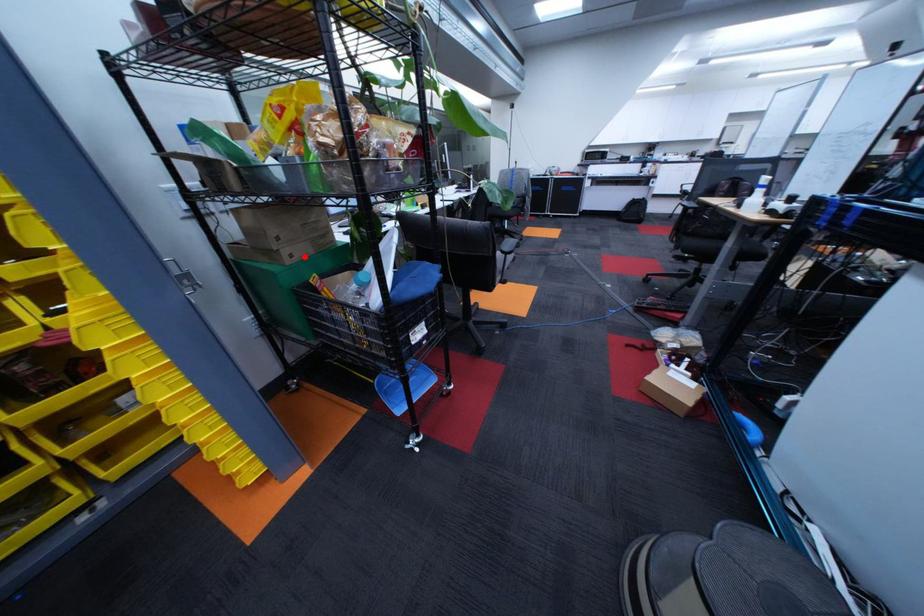
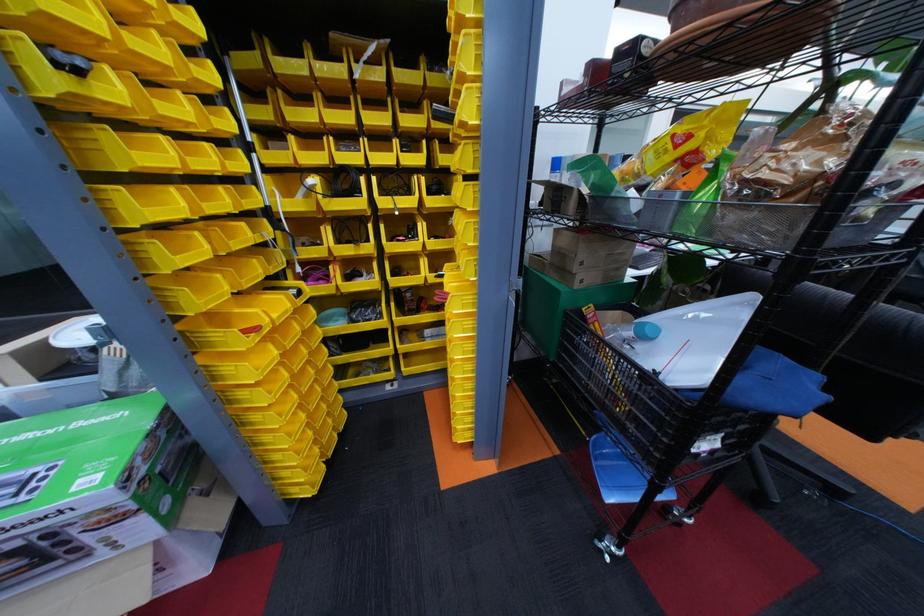
Locate, in the second image, the point that corresponds to the highlighted location in the first image.

(594, 282)